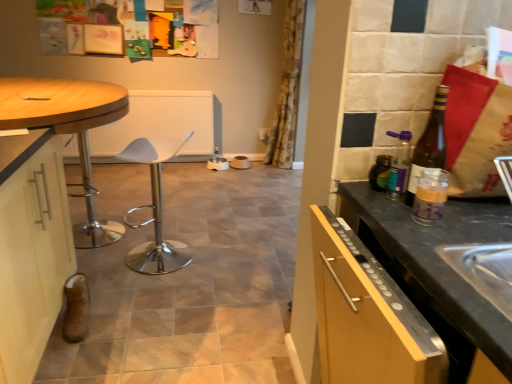
Question: Is matte white cabinet at left to the left or to the right of translucent glass bottle at right, acting as the 2th bottle starting from the back, in the image?

Choices:
 (A) left
 (B) right

Answer: (A)

Question: Is point (10, 347) positioned closer to the camera than point (430, 114)?

Choices:
 (A) closer
 (B) farther

Answer: (B)

Question: Considering the real-world distances, which object is farthest from the floral fabric curtain at center?

Choices:
 (A) white plastic bar stool at center
 (B) translucent plastic jar at right, the 3th bottle from the back
 (C) translucent glass bottle at right, acting as the 2th bottle starting from the back
 (D) matte white cabinet at left
 (E) green glass bottle at right, which appears as the third bottle when viewed from the front

Answer: (B)

Question: Estimate the real-world distances between objects in this image. Which object is closer to the green glass bottle at right, marked as the first bottle in a back-to-front arrangement?

Choices:
 (A) translucent plastic jar at right, the 3th bottle from the back
 (B) matte white cabinet at left
 (C) wooden polished table at left
 (D) translucent glass bottle at right, acting as the 2th bottle starting from the front
 (E) floral fabric curtain at center

Answer: (D)